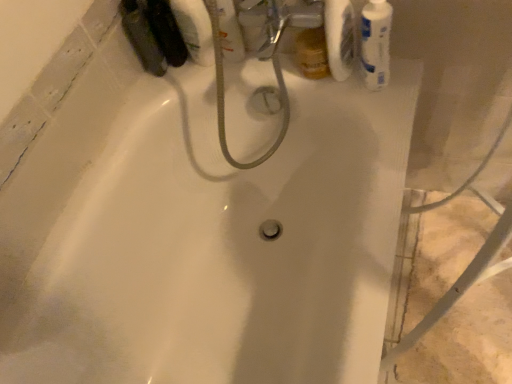
You are a GUI agent. You are given a task and a screenshot of the screen. Output one action in this format:
    pyautogui.click(x=<x>, y=<y>)
    Task: Click on the free location in front of white glossy mouthwash at upper right, arranged as the first mouthwash when viewed from the right
    The width and height of the screenshot is (512, 384).
    Given the screenshot: What is the action you would take?
    pyautogui.click(x=386, y=115)